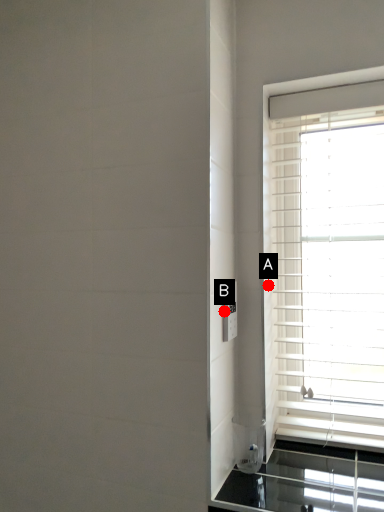
Question: Two points are circled on the image, labeled by A and B beside each circle. Which point is further to the camera?

Choices:
 (A) A is further
 (B) B is further

Answer: (A)